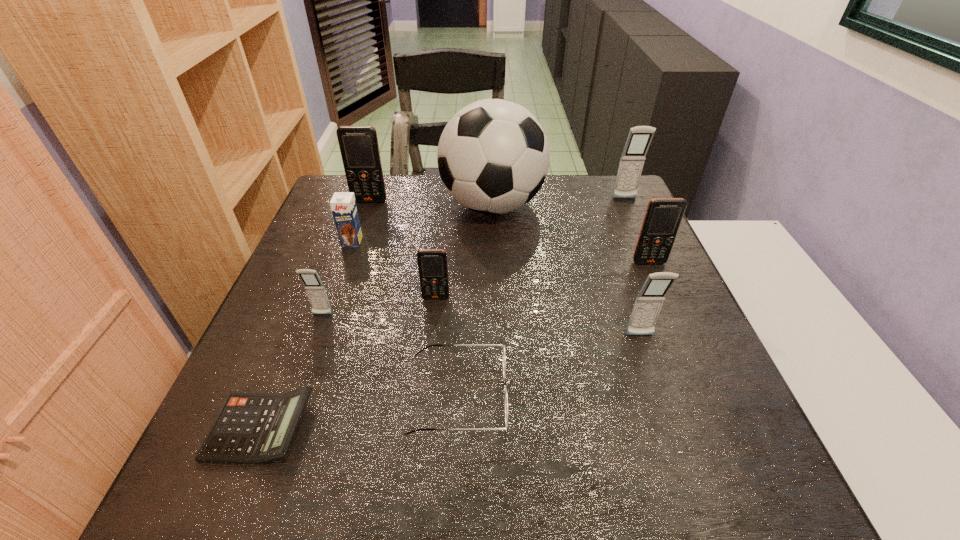
Locate an element on the screen. The image size is (960, 540). gray cellular telephone identified as the closest to the farthest orange cellular telephone is located at coordinates (315, 290).

This screenshot has height=540, width=960. Find the location of `orange cellular telephone that is the third closest to the calculator`. orange cellular telephone that is the third closest to the calculator is located at coordinates (663, 216).

Select which orange cellular telephone appears as the second closest to the black spectacles. Please provide its 2D coordinates. Your answer should be formatted as a tuple, i.e. [(x, y)], where the tuple contains the x and y coordinates of a point satisfying the conditions above.

[(663, 216)]

At what (x,y) coordinates should I click in order to perform the action: click on free location that satisfies the following two spatial constraints: 1. on the front-facing side of the second biggest gray cellular telephone; 2. on the front-facing side of the black spectacles. Please return your answer as a coordinate pair (x, y). Looking at the image, I should click on (660, 395).